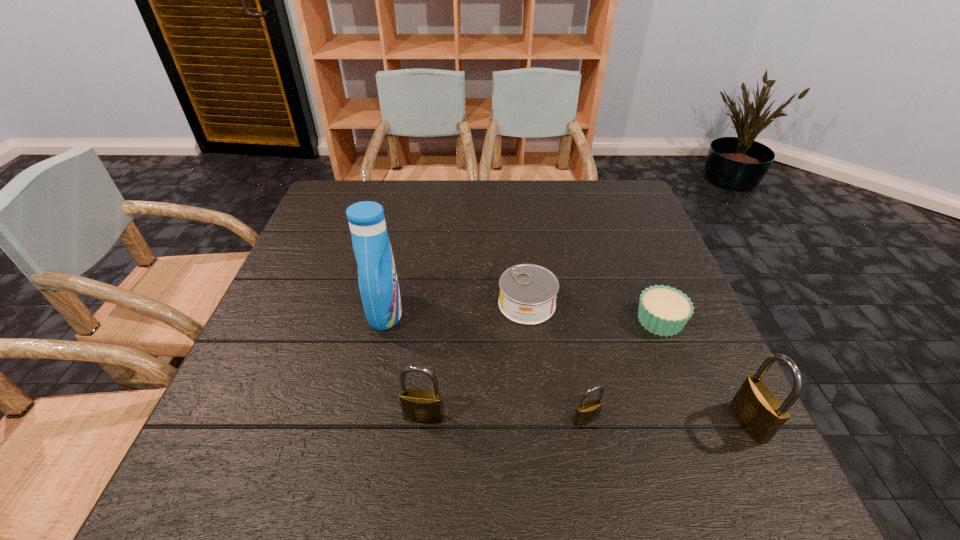
Image resolution: width=960 pixels, height=540 pixels. I want to click on free point between the detergent and the second padlock from right to left, so click(486, 366).

Image resolution: width=960 pixels, height=540 pixels. I want to click on object that is the second closest to the second object from right to left, so click(x=528, y=292).

Identify the location of the fourth closest object to the shortest padlock. (758, 410).

The height and width of the screenshot is (540, 960). In order to click on the third closest padlock to the fifth object from left to right in this screenshot , I will do `click(423, 406)`.

The image size is (960, 540). I want to click on padlock that is the closest to the leftmost object, so click(x=423, y=406).

Image resolution: width=960 pixels, height=540 pixels. What are the coordinates of `vacant position in the image that satisfies the following two spatial constraints: 1. on the front-facing side of the tallest object; 2. on the right side of the fifth object from left to right` in the screenshot? It's located at (383, 320).

Locate an element on the screen. This screenshot has width=960, height=540. free space that satisfies the following two spatial constraints: 1. on the front side of the leftmost padlock; 2. on the left side of the second padlock from right to left is located at coordinates (423, 420).

This screenshot has width=960, height=540. In order to click on vacant space that satisfies the following two spatial constraints: 1. on the front-facing side of the detergent; 2. on the back side of the cupcake in this screenshot , I will do `click(383, 320)`.

This screenshot has height=540, width=960. What are the coordinates of `free space that satisfies the following two spatial constraints: 1. on the front-facing side of the leftmost object; 2. on the back side of the third shortest object` in the screenshot? It's located at click(x=362, y=420).

Where is `free space in the image that satisfies the following two spatial constraints: 1. on the front-facing side of the second tallest padlock; 2. on the left side of the detergent`? free space in the image that satisfies the following two spatial constraints: 1. on the front-facing side of the second tallest padlock; 2. on the left side of the detergent is located at coordinates (362, 417).